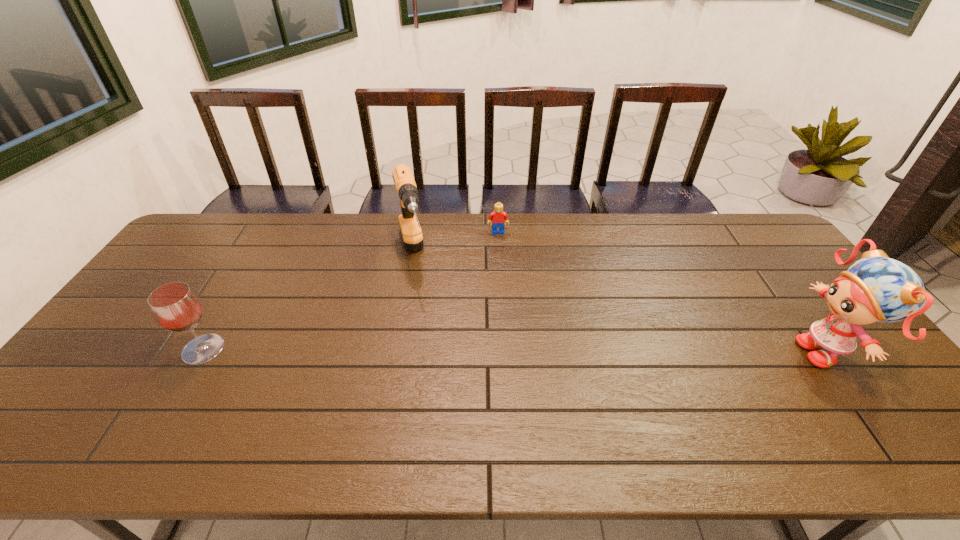
In the image, there is a desktop. What are the coordinates of `vacant space at the near edge` in the screenshot? It's located at point(469,402).

Where is `free location at the left edge of the desktop`? The height and width of the screenshot is (540, 960). free location at the left edge of the desktop is located at coordinates 118,384.

Locate an element on the screen. Image resolution: width=960 pixels, height=540 pixels. vacant space at the far right corner is located at coordinates [x=764, y=241].

Where is `unoccupied area between the second shortest object and the Lego`? unoccupied area between the second shortest object and the Lego is located at coordinates (350, 291).

The height and width of the screenshot is (540, 960). I want to click on unoccupied position between the second object from right to left and the leftmost object, so click(x=350, y=291).

Locate an element on the screen. free space that is in between the Lego and the rightmost object is located at coordinates (663, 292).

Locate an element on the screen. unoccupied area between the Lego and the drill is located at coordinates (455, 243).

The image size is (960, 540). I want to click on vacant point located between the drill and the doll, so click(620, 302).

Identify the location of vacant area that lies between the leftmost object and the second object from left to right. This screenshot has width=960, height=540. (308, 301).

Identify the location of empty location between the doll and the shortest object. (663, 292).